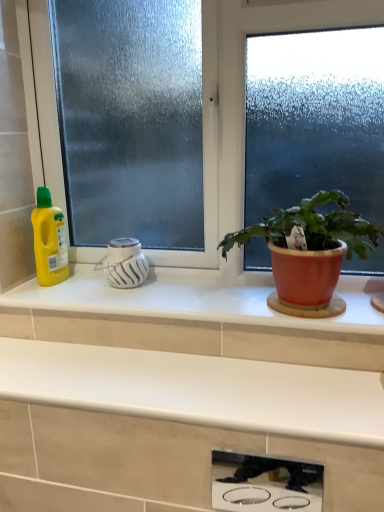
This screenshot has height=512, width=384. In order to click on frosted glass window at center in this screenshot , I will do `click(243, 104)`.

How much space does stainless steel cooktop at lower center, which is counted as the second appliance, starting from the left, occupy vertically?

stainless steel cooktop at lower center, which is counted as the second appliance, starting from the left, is 14.86 centimeters tall.

The height and width of the screenshot is (512, 384). Find the location of `white glossy countertop at center, which is the 1th countertop in top-to-bottom order`. white glossy countertop at center, which is the 1th countertop in top-to-bottom order is located at coordinates (195, 298).

The height and width of the screenshot is (512, 384). In order to click on window behind the stainless steel cooktop at lower center, which is counted as the second appliance, starting from the left in this screenshot , I will do `click(243, 104)`.

Can you confirm if stainless steel cooktop at lower center, which ranks as the first appliance in right-to-left order, is wider than frosted glass window at center?

No.

How distant is stainless steel cooktop at lower center, placed as the second appliance when sorted from top to bottom, from frosted glass window at center?

stainless steel cooktop at lower center, placed as the second appliance when sorted from top to bottom, is 4.12 feet from frosted glass window at center.

How many degrees apart are the facing directions of stainless steel cooktop at lower center, placed as the second appliance when sorted from top to bottom, and frosted glass window at center?

The facing directions of stainless steel cooktop at lower center, placed as the second appliance when sorted from top to bottom, and frosted glass window at center are 0.00115 degrees apart.

Relative to white matte countertop at center, which appears as the 2th countertop when viewed from the top, is white glossy countertop at center, which is the 1th countertop in top-to-bottom order, in front or behind?

In the image, white glossy countertop at center, which is the 1th countertop in top-to-bottom order, appears behind white matte countertop at center, which appears as the 2th countertop when viewed from the top.

Is white glossy countertop at center, acting as the second countertop starting from the bottom, spatially inside white matte countertop at center, placed as the first countertop when sorted from bottom to top, or outside of it?

white glossy countertop at center, acting as the second countertop starting from the bottom, is not enclosed by white matte countertop at center, placed as the first countertop when sorted from bottom to top.

From a real-world perspective, is white glossy countertop at center, acting as the second countertop starting from the bottom, on white matte countertop at center, which appears as the 2th countertop when viewed from the top?

Yes.

Is stainless steel cooktop at lower center, arranged as the 1th appliance when viewed from the front, to the right of matte terracotta pot at right from the viewer's perspective?

Incorrect, stainless steel cooktop at lower center, arranged as the 1th appliance when viewed from the front, is not on the right side of matte terracotta pot at right.

Is stainless steel cooktop at lower center, arranged as the 1th appliance when viewed from the front, in front of or behind matte terracotta pot at right in the image?

stainless steel cooktop at lower center, arranged as the 1th appliance when viewed from the front, is positioned closer to the viewer than matte terracotta pot at right.

From the image's perspective, is stainless steel cooktop at lower center, the second appliance in the back-to-front sequence, located above or below matte terracotta pot at right?

Based on their image positions, stainless steel cooktop at lower center, the second appliance in the back-to-front sequence, is located beneath matte terracotta pot at right.

In terms of size, does frosted glass window at center appear bigger or smaller than yellow plastic bottle at left?

In the image, frosted glass window at center appears to be larger than yellow plastic bottle at left.

Are frosted glass window at center and yellow plastic bottle at left beside each other?

No, frosted glass window at center is not next to yellow plastic bottle at left.

Is point (36, 154) positioned after point (47, 203)?

Yes, it is behind point (47, 203).

The image size is (384, 512). In order to click on cleaning product to the left of frosted glass window at center in this screenshot , I will do `click(49, 240)`.

Could you tell me if matte terracotta pot at right is turned towards stainless steel cooktop at lower center, which ranks as the first appliance in right-to-left order?

No, matte terracotta pot at right is not turned towards stainless steel cooktop at lower center, which ranks as the first appliance in right-to-left order.

From the image's perspective, does matte terracotta pot at right appear higher than stainless steel cooktop at lower center, which is counted as the second appliance, starting from the left?

Indeed, from the image's perspective, matte terracotta pot at right is shown above stainless steel cooktop at lower center, which is counted as the second appliance, starting from the left.

Looking at this image, how far apart are white matte countertop at center, which appears as the 2th countertop when viewed from the top, and white glossy countertop at center, which is the 1th countertop in top-to-bottom order?

8.11 inches.

Is point (165, 359) closer to viewer compared to point (336, 323)?

No, (165, 359) is further to viewer.

Would you say white matte countertop at center, which appears as the 2th countertop when viewed from the top, is a long distance from white glossy countertop at center, acting as the second countertop starting from the bottom?

white matte countertop at center, which appears as the 2th countertop when viewed from the top, is actually quite close to white glossy countertop at center, acting as the second countertop starting from the bottom.

Is white glossy countertop at center, acting as the second countertop starting from the bottom, completely or partially inside white matte countertop at center, which appears as the 2th countertop when viewed from the top?

No, white glossy countertop at center, acting as the second countertop starting from the bottom, is located outside of white matte countertop at center, which appears as the 2th countertop when viewed from the top.

Considering the relative positions of frosted glass window at center and white matte countertop at center, which appears as the 2th countertop when viewed from the top, in the image provided, is frosted glass window at center to the left of white matte countertop at center, which appears as the 2th countertop when viewed from the top, from the viewer's perspective?

No, frosted glass window at center is not to the left of white matte countertop at center, which appears as the 2th countertop when viewed from the top.

Between point (237, 10) and point (325, 460), which one is positioned behind?

Point (237, 10)

You are a GUI agent. You are given a task and a screenshot of the screen. Output one action in this format:
    pyautogui.click(x=<x>, y=<y>)
    Task: Click on the window that appears behind the white matte countertop at center, placed as the first countertop when sorted from bottom to top
    The image size is (384, 512).
    Given the screenshot: What is the action you would take?
    pyautogui.click(x=243, y=104)

Would you say frosted glass window at center is a long distance from white matte countertop at center, which appears as the 2th countertop when viewed from the top?

frosted glass window at center is near white matte countertop at center, which appears as the 2th countertop when viewed from the top, not far away.

You are a GUI agent. You are given a task and a screenshot of the screen. Output one action in this format:
    pyautogui.click(x=<x>, y=<y>)
    Task: Click on the window located above the stainless steel cooktop at lower center, which ranks as the first appliance in bottom-to-top order (from the image's perspective)
    
    Given the screenshot: What is the action you would take?
    pyautogui.click(x=243, y=104)

What are the coordinates of `countertop on the left of white glossy countertop at center, which is the 1th countertop in top-to-bottom order` in the screenshot? It's located at (182, 421).

Which object lies further to the anchor point stainless steel cooktop at lower center, which is counted as the second appliance, starting from the left, matte terracotta pot at right or yellow plastic bottle at left?

yellow plastic bottle at left.

When comparing their distances from white matte diffuser at center, which is the 2th appliance from front to back, does frosted glass window at center or white glossy countertop at center, acting as the second countertop starting from the bottom, seem closer?

white glossy countertop at center, acting as the second countertop starting from the bottom, is positioned closer to the anchor white matte diffuser at center, which is the 2th appliance from front to back.

Looking at the image, which one is located further to white matte diffuser at center, positioned as the first appliance in top-to-bottom order, yellow plastic bottle at left or white glossy countertop at center, acting as the second countertop starting from the bottom?

Based on the image, white glossy countertop at center, acting as the second countertop starting from the bottom, appears to be further to white matte diffuser at center, positioned as the first appliance in top-to-bottom order.

Estimate the real-world distances between objects in this image. Which object is further from frosted glass window at center, white glossy countertop at center, acting as the second countertop starting from the bottom, or white matte countertop at center, placed as the first countertop when sorted from bottom to top?

Among the two, white matte countertop at center, placed as the first countertop when sorted from bottom to top, is located further to frosted glass window at center.

Estimate the real-world distances between objects in this image. Which object is further from stainless steel cooktop at lower center, the second appliance in the back-to-front sequence, white matte countertop at center, which appears as the 2th countertop when viewed from the top, or white glossy countertop at center, which is the 1th countertop in top-to-bottom order?

white glossy countertop at center, which is the 1th countertop in top-to-bottom order, is further to stainless steel cooktop at lower center, the second appliance in the back-to-front sequence.

Based on their spatial positions, is white glossy countertop at center, which is the 1th countertop in top-to-bottom order, or yellow plastic bottle at left closer to matte terracotta pot at right?

Based on the image, white glossy countertop at center, which is the 1th countertop in top-to-bottom order, appears to be nearer to matte terracotta pot at right.

Considering their positions, is stainless steel cooktop at lower center, which is counted as the second appliance, starting from the left, positioned closer to white matte countertop at center, placed as the first countertop when sorted from bottom to top, than yellow plastic bottle at left?

yellow plastic bottle at left lies closer to white matte countertop at center, placed as the first countertop when sorted from bottom to top, than the other object.

Which object lies further to the anchor point matte terracotta pot at right, stainless steel cooktop at lower center, which ranks as the first appliance in right-to-left order, or white matte countertop at center, placed as the first countertop when sorted from bottom to top?

Among the two, stainless steel cooktop at lower center, which ranks as the first appliance in right-to-left order, is located further to matte terracotta pot at right.

Identify the location of houseplant between frosted glass window at center and stainless steel cooktop at lower center, which is counted as the second appliance, starting from the left, from top to bottom. This screenshot has width=384, height=512. (309, 253).

Locate an element on the screen. cleaning product that lies between frosted glass window at center and white matte countertop at center, placed as the first countertop when sorted from bottom to top, from top to bottom is located at coordinates (49, 240).

Locate an element on the screen. countertop between white glossy countertop at center, acting as the second countertop starting from the bottom, and stainless steel cooktop at lower center, which ranks as the first appliance in bottom-to-top order, in the up-down direction is located at coordinates (182, 421).

You are a GUI agent. You are given a task and a screenshot of the screen. Output one action in this format:
    pyautogui.click(x=<x>, y=<y>)
    Task: Click on the appliance between frosted glass window at center and white matte countertop at center, placed as the first countertop when sorted from bottom to top, in the up-down direction
    
    Given the screenshot: What is the action you would take?
    pyautogui.click(x=124, y=263)